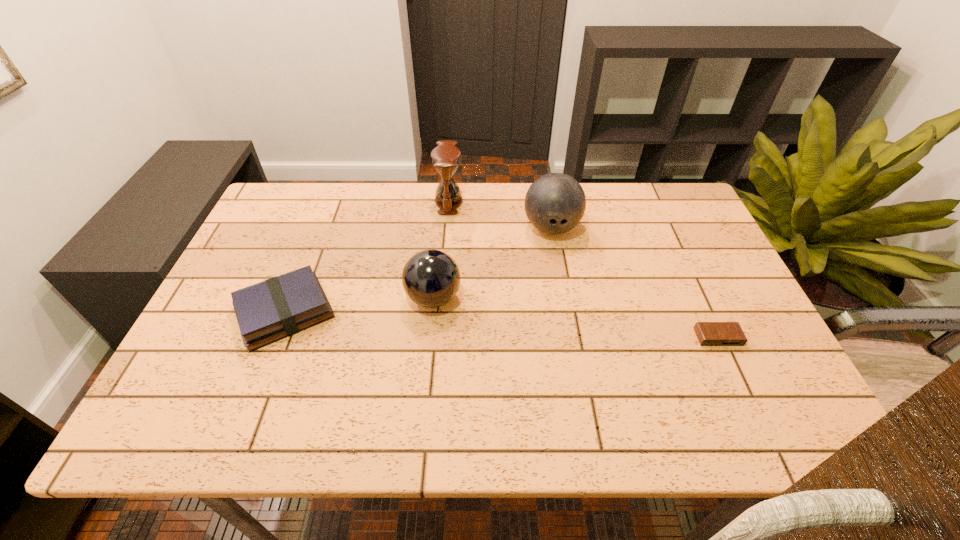
Locate an element on the screen. vacant space situated 0.130m on the grip area of the fourth object from left to right is located at coordinates (561, 280).

At what (x,y) coordinates should I click in order to perform the action: click on free spot located on the side of the nearer bowling ball with the finger holes. Please return your answer as a coordinate pair (x, y). The image size is (960, 540). Looking at the image, I should click on (520, 298).

This screenshot has height=540, width=960. Find the location of `free space located 0.240m on the right of the fourth tallest object`. free space located 0.240m on the right of the fourth tallest object is located at coordinates (434, 312).

Image resolution: width=960 pixels, height=540 pixels. I want to click on vacant space positioned 0.140m on the front face of the alarm clock, so click(748, 401).

You are a GUI agent. You are given a task and a screenshot of the screen. Output one action in this format:
    pyautogui.click(x=<x>, y=<y>)
    Task: Click on the hourglass positioned at the far edge
    
    Given the screenshot: What is the action you would take?
    click(445, 157)

In order to click on bowling ball located in the far edge section of the desktop in this screenshot , I will do `click(555, 203)`.

Identify the location of object that is at the left edge. This screenshot has height=540, width=960. (279, 307).

I want to click on object located in the right edge section of the desktop, so point(708,333).

In the image, there is a desktop. Identify the location of vacant space at the far edge. (589, 186).

What are the coordinates of `blank space at the near edge of the desktop` in the screenshot? It's located at (707, 399).